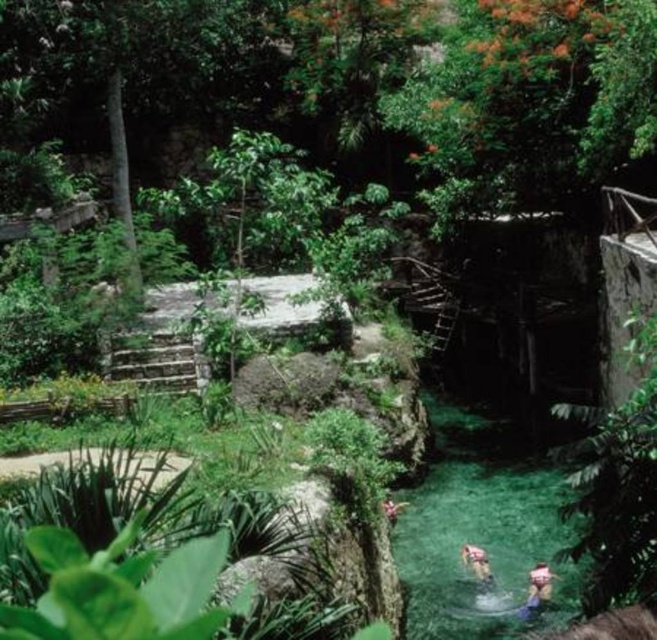
You are a lifeguard at this tropical pool and need to ensure all swimmers are visible from your post. Considering the light brown fabric person at lower center and the yellow fabric person at lower center, which swimmer takes up more space in the water and might be easier to spot?

The yellow fabric person at lower center occupies more space than the light brown fabric person at lower center, making them easier to spot.